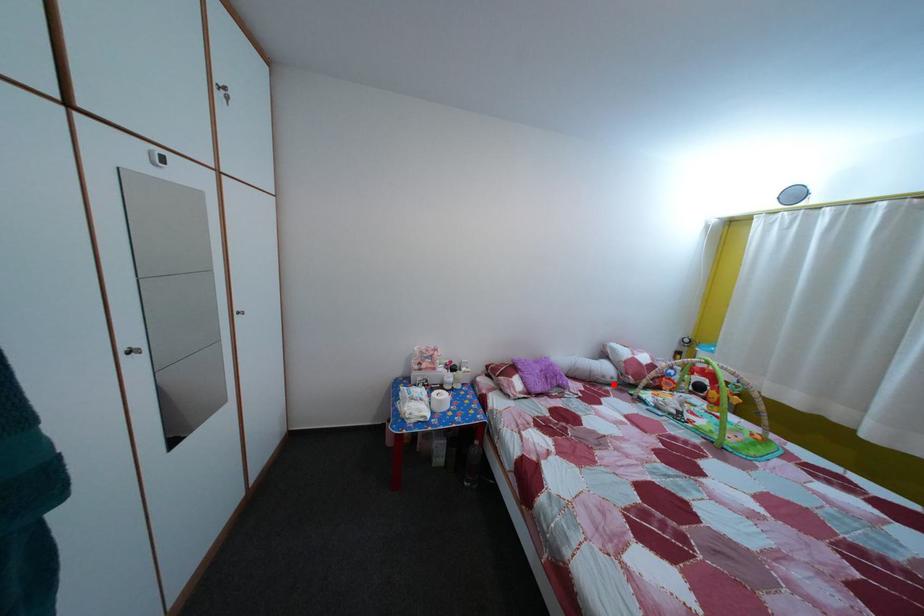
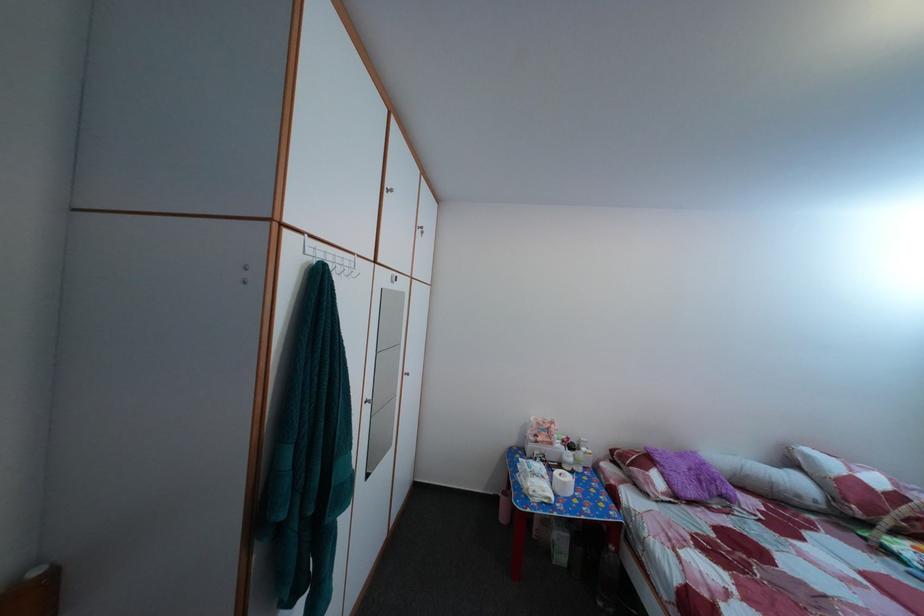
In the second image, find the point that corresponds to the highlighted location in the first image.

(808, 504)